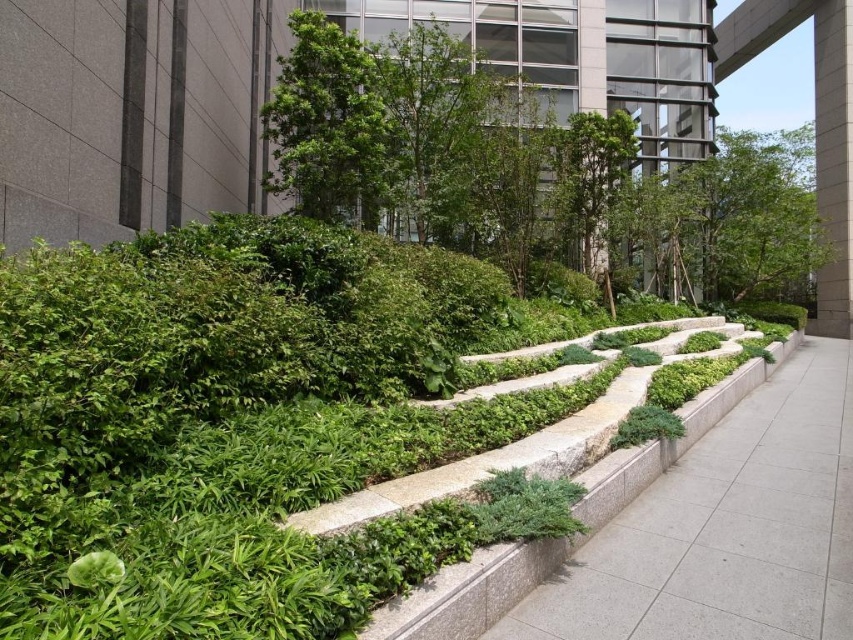
Is gray concrete pavement at center smaller than green leafy tree at center?

Yes.

Between gray concrete pavement at center and green leafy tree at center, which one appears on the left side from the viewer's perspective?

green leafy tree at center is more to the left.

I want to click on gray concrete pavement at center, so click(726, 529).

The image size is (853, 640). What are the coordinates of `gray concrete pavement at center` in the screenshot? It's located at (726, 529).

Is gray concrete pavement at center smaller than green leafy tree at upper center?

Yes, gray concrete pavement at center is smaller than green leafy tree at upper center.

In the scene shown: Is gray concrete pavement at center positioned in front of green leafy tree at upper center?

That is True.

Is point (795, 502) farther from camera compared to point (544, 0)?

No, it is in front of (544, 0).

Image resolution: width=853 pixels, height=640 pixels. I want to click on gray concrete pavement at center, so click(726, 529).

You are a GUI agent. You are given a task and a screenshot of the screen. Output one action in this format:
    pyautogui.click(x=<x>, y=<y>)
    Task: Click on the green leafy tree at upper center
    The width and height of the screenshot is (853, 640).
    Given the screenshot: What is the action you would take?
    pyautogui.click(x=665, y=76)

Looking at this image, can you confirm if green leafy tree at upper center is thinner than green leafy tree at center?

Incorrect, green leafy tree at upper center's width is not less than green leafy tree at center's.

Between point (648, 124) and point (358, 209), which one is positioned behind?

Positioned behind is point (648, 124).

This screenshot has height=640, width=853. I want to click on green leafy tree at upper center, so click(665, 76).